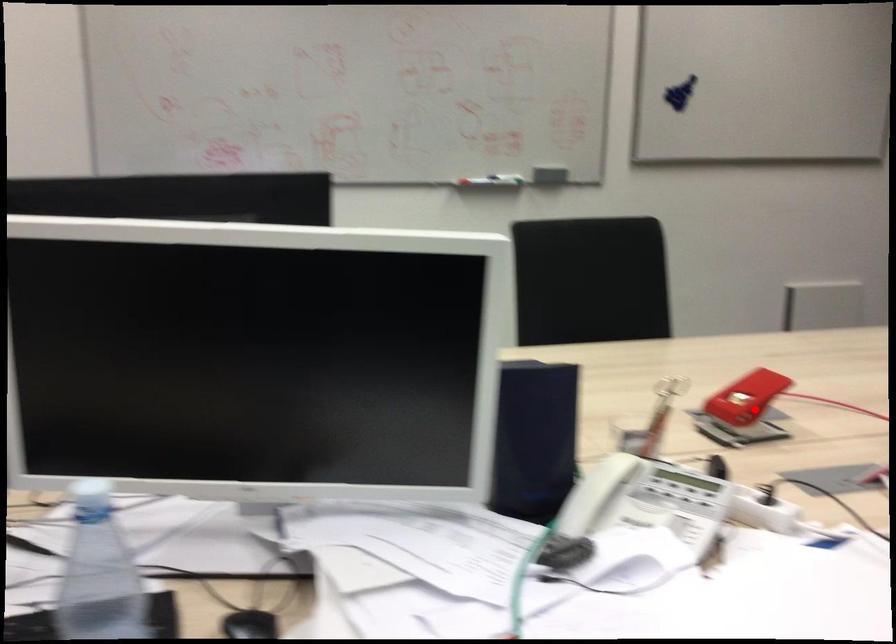
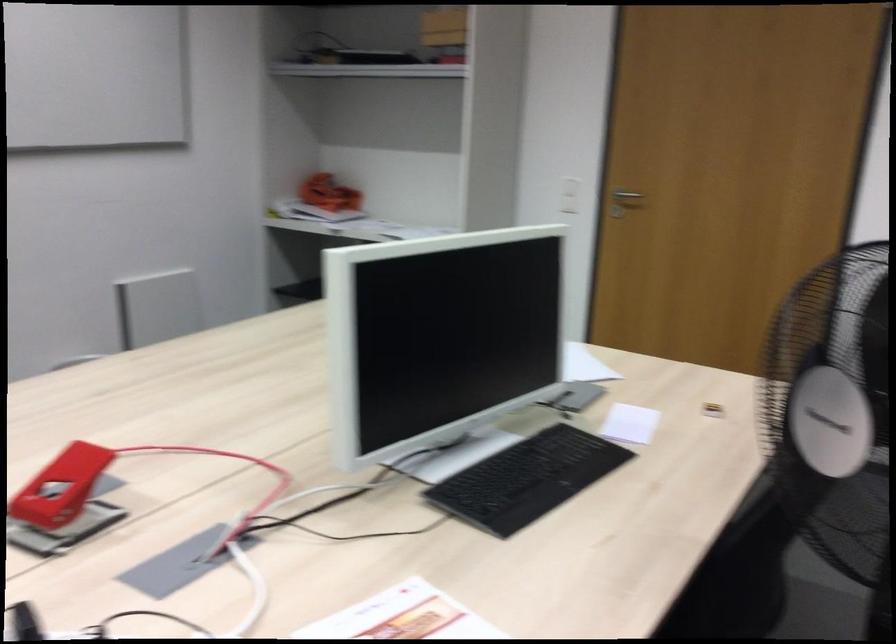
Question: A red point is marked in image1. In image2, is the corresponding 3D point closer to the camera or farther? Reply with the corresponding letter.

Choices:
 (A) The corresponding 3D point is closer.
 (B) The corresponding 3D point is farther.

Answer: (A)